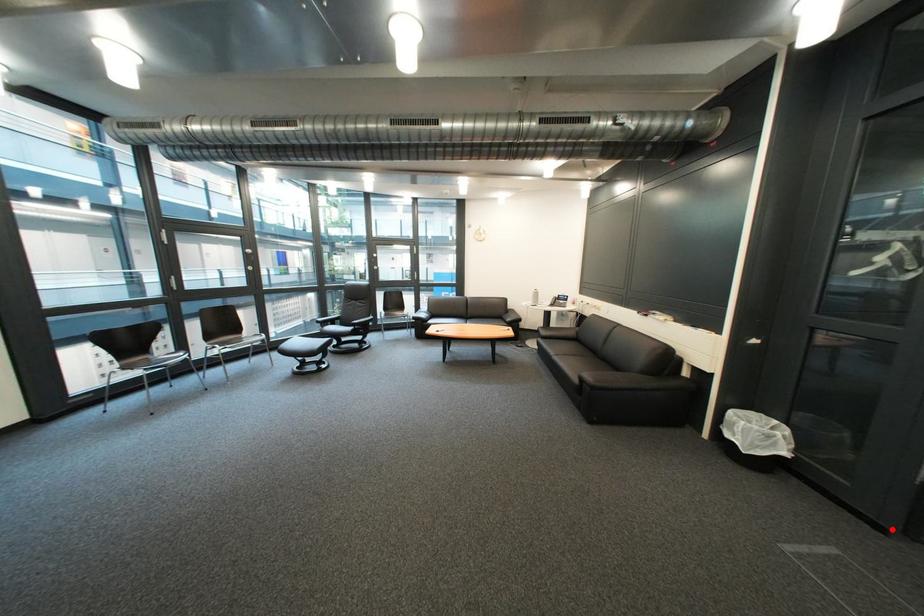
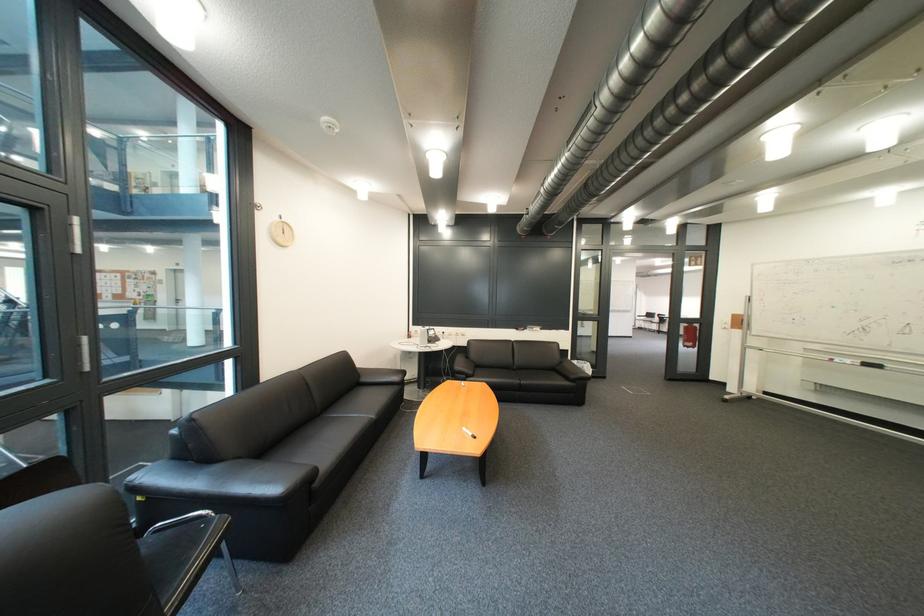
Question: I am providing you with two images of the same scene from different viewpoints. Image1 has a red point marked. In image2, the corresponding 3D location appears at what relative position? Reply with the corresponding letter.

Choices:
 (A) Closer
 (B) Farther

Answer: (B)